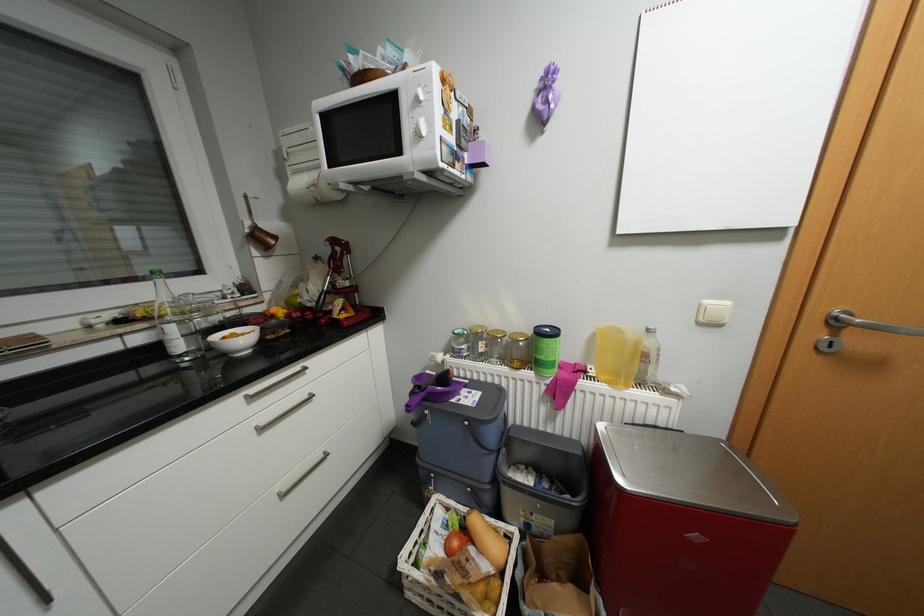
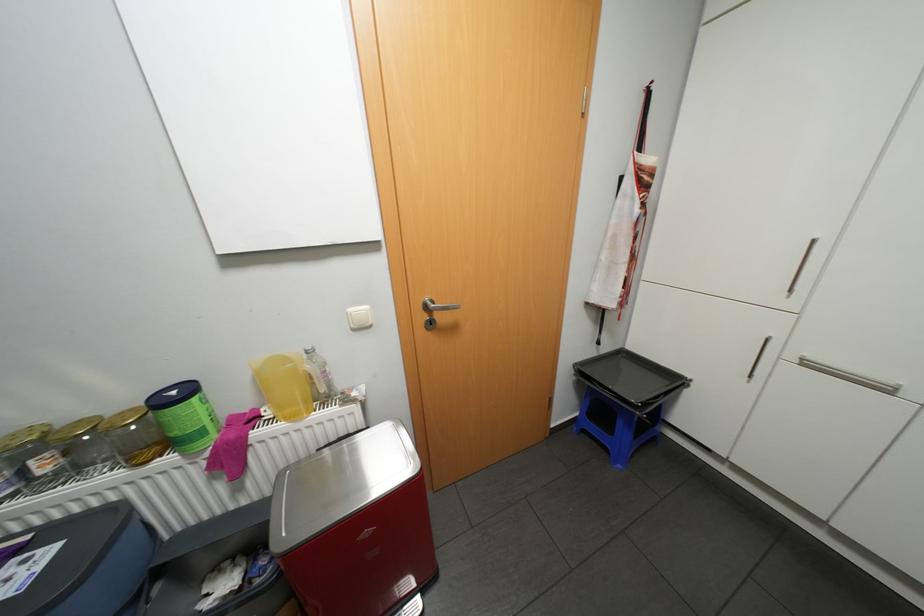
The point at (714, 301) is marked in the first image. Where is the corresponding point in the second image?

(358, 309)